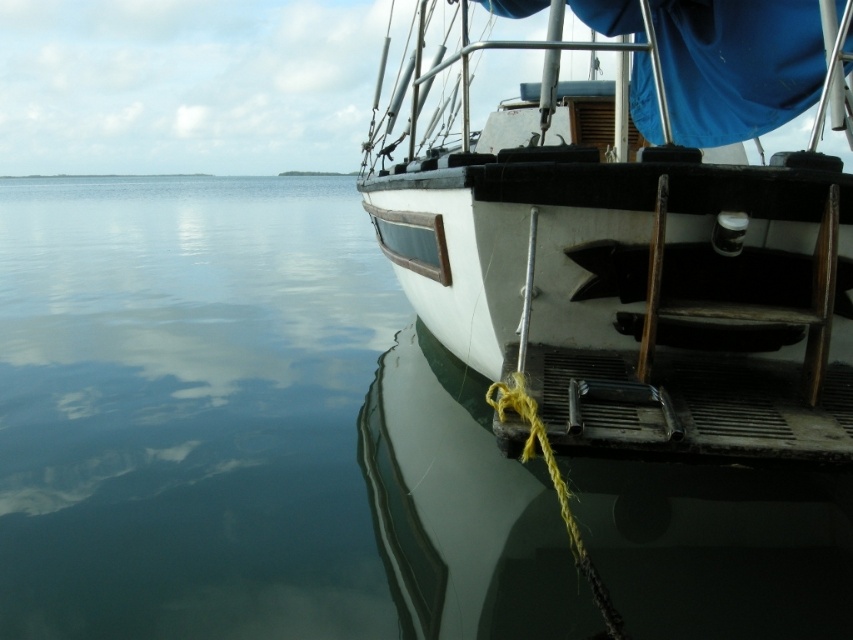
Which is more to the left, clear water at lower left or white matte boat at center?

From the viewer's perspective, clear water at lower left appears more on the left side.

Between clear water at lower left and white matte boat at center, which one has less height?

Standing shorter between the two is white matte boat at center.

Identify the location of clear water at lower left. (189, 408).

Measure the distance from clear water at lower left to yellow string at lower center.

clear water at lower left and yellow string at lower center are 9.65 meters apart from each other.

I want to click on clear water at lower left, so point(189,408).

Is white matte boat at center smaller than yellow string at lower center?

No, white matte boat at center is not smaller than yellow string at lower center.

Who is positioned more to the left, white matte boat at center or yellow string at lower center?

Positioned to the left is yellow string at lower center.

Between point (651, 321) and point (519, 406), which one is positioned in front?

Positioned in front is point (519, 406).

Locate an element on the screen. The height and width of the screenshot is (640, 853). white matte boat at center is located at coordinates (631, 275).